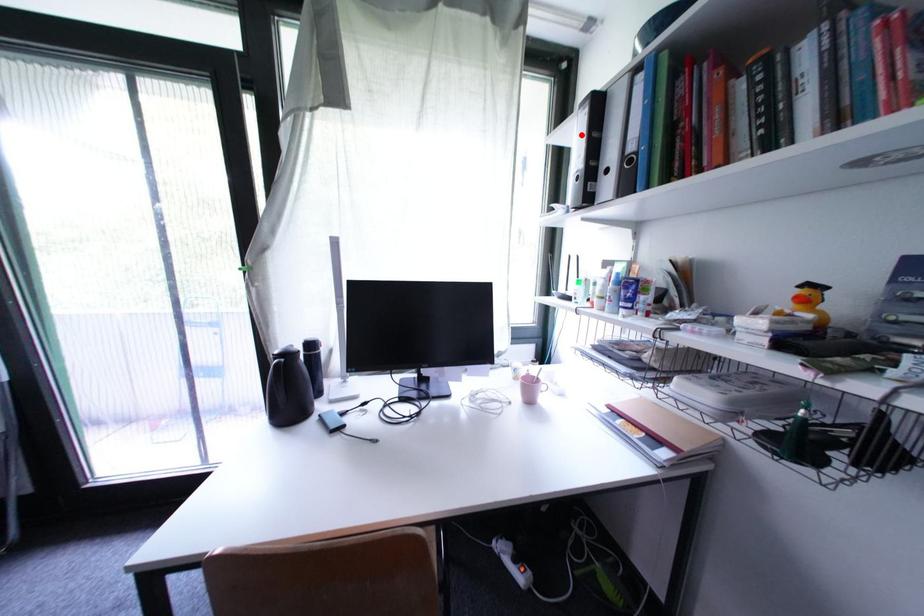
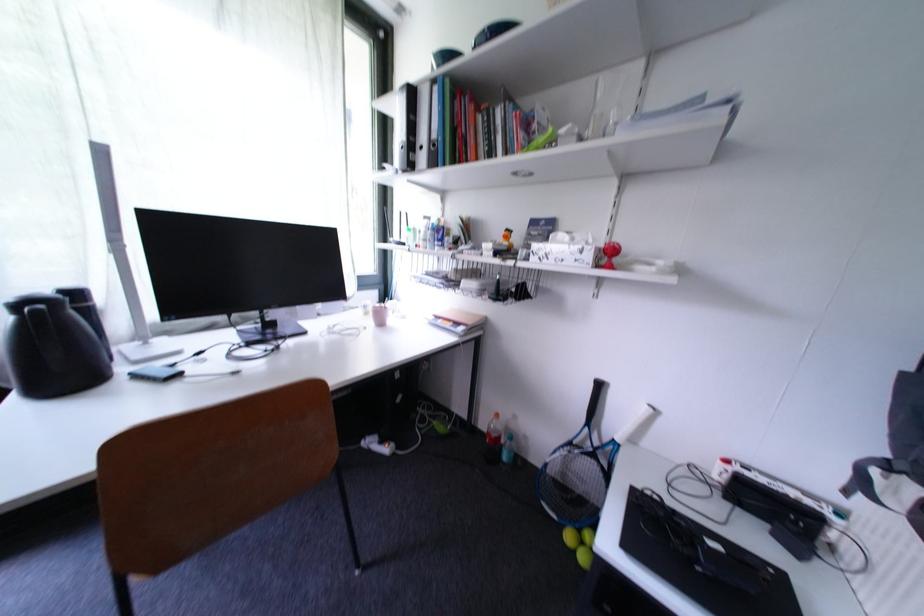
Question: I am providing you with two images of the same scene from different viewpoints. Given a red point in image1, look at the same physical point in image2. Is it:

Choices:
 (A) Closer to the viewpoint
 (B) Farther from the viewpoint

Answer: (A)